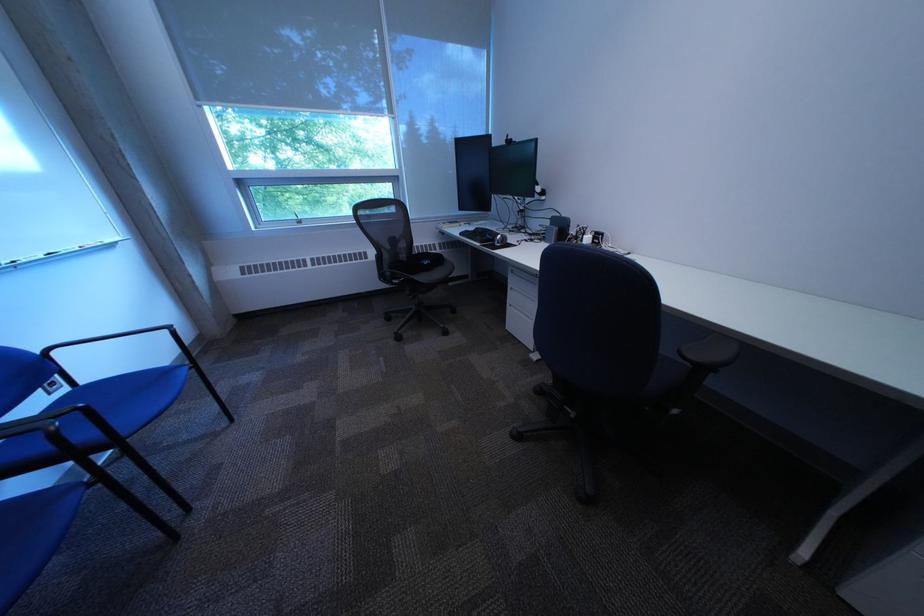
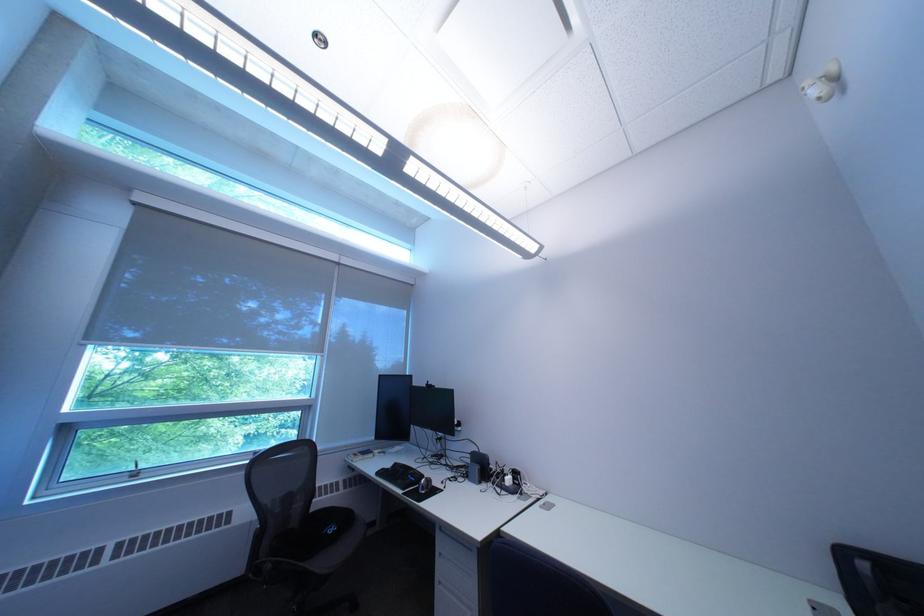
The point at (x=477, y=236) is marked in the first image. Where is the corresponding point in the second image?

(393, 475)